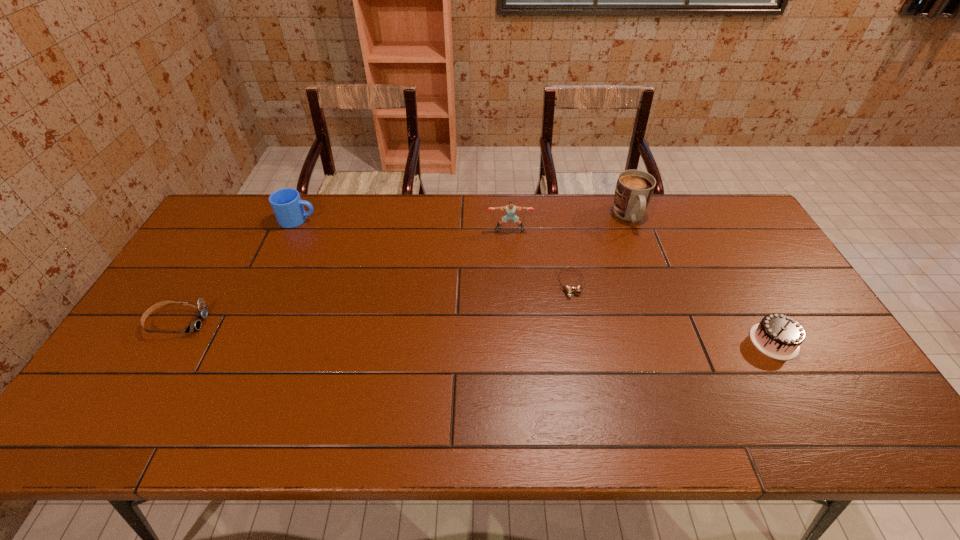
Identify the location of free space located 0.320m on the side of the second object from right to left with the handle. (664, 307).

Where is `free region located 0.270m on the front-facing side of the puncher`? free region located 0.270m on the front-facing side of the puncher is located at coordinates (515, 294).

The height and width of the screenshot is (540, 960). Identify the location of vacant region located on the side of the shorter mug with the handle. (338, 220).

Where is `vacant space located on the back of the rightmost object`? vacant space located on the back of the rightmost object is located at coordinates (746, 291).

The image size is (960, 540). What are the coordinates of `vacant space located 0.190m on the front-facing side of the fifth tallest object` in the screenshot? It's located at (275, 322).

At what (x,y) coordinates should I click in order to perform the action: click on free location located on the front lenses and sides of the shortest object. Please return your answer as a coordinate pair (x, y). Image resolution: width=960 pixels, height=540 pixels. Looking at the image, I should click on (590, 384).

This screenshot has height=540, width=960. Find the location of `puncher that is at the far edge`. puncher that is at the far edge is located at coordinates (510, 209).

Find the location of a particular element. Image resolution: width=960 pixels, height=540 pixels. object at the left edge is located at coordinates (202, 312).

Locate an element on the screen. object present at the right edge is located at coordinates (779, 336).

Where is `vacant space at the far edge of the desktop`? vacant space at the far edge of the desktop is located at coordinates (490, 220).